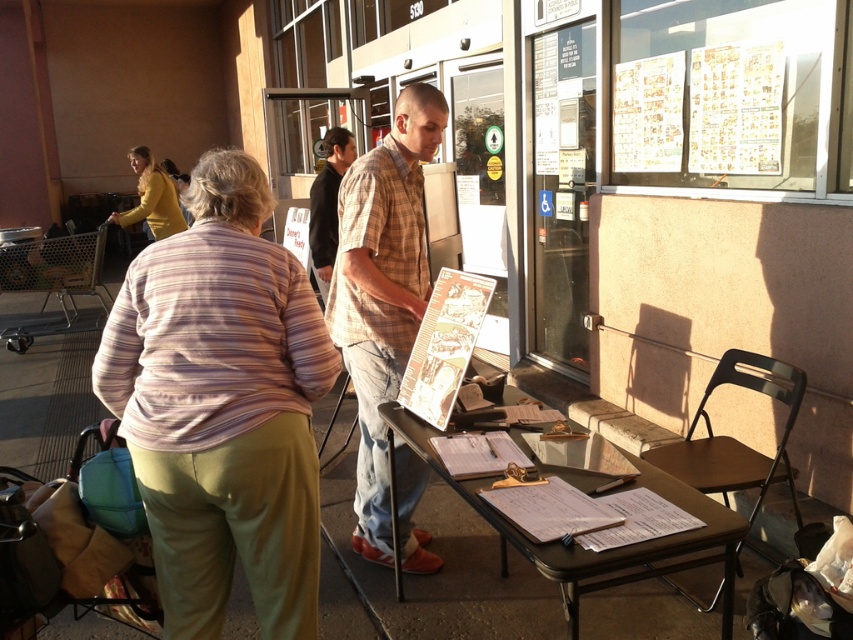
Question: Which point appears closest to the camera in this image?

Choices:
 (A) (223, 516)
 (B) (151, 198)
 (C) (403, 332)
 (D) (437, 474)

Answer: (A)

Question: Which object is the farthest from the metallic brown clipboard at center?

Choices:
 (A) plaid shirt at center
 (B) plaid cotton shirt at center
 (C) matte yellow sweater at upper left
 (D) striped cotton shirt at left

Answer: (C)

Question: Can you confirm if striped cotton shirt at left is wider than metallic brown clipboard at center?

Choices:
 (A) yes
 (B) no

Answer: (B)

Question: Among these points, which one is nearest to the camera?

Choices:
 (A) (311, 211)
 (B) (549, 557)
 (C) (148, 355)

Answer: (B)

Question: Can you confirm if striped cotton shirt at left is wider than matte yellow sweater at upper left?

Choices:
 (A) yes
 (B) no

Answer: (B)

Question: Is striped cotton shirt at left closer to camera compared to plaid cotton shirt at center?

Choices:
 (A) yes
 (B) no

Answer: (A)